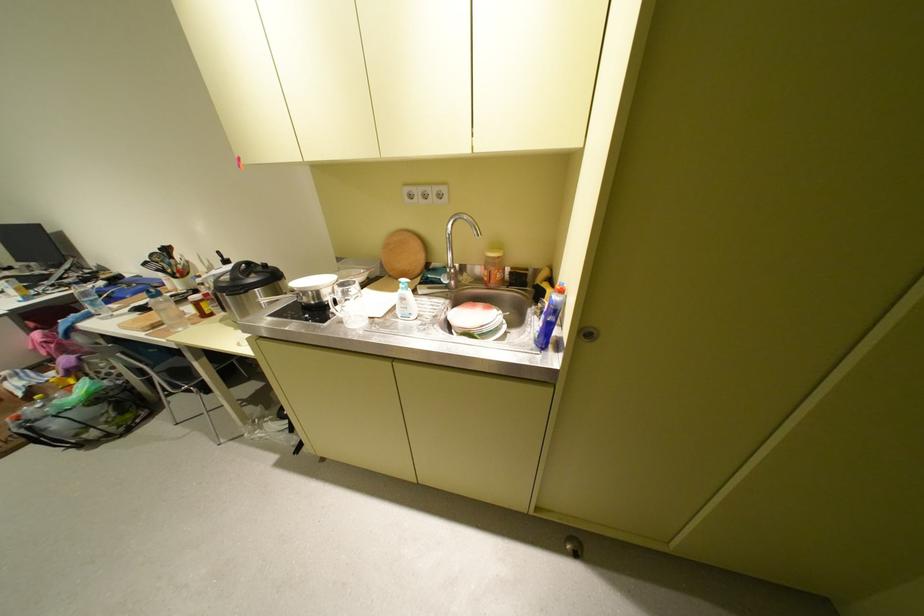
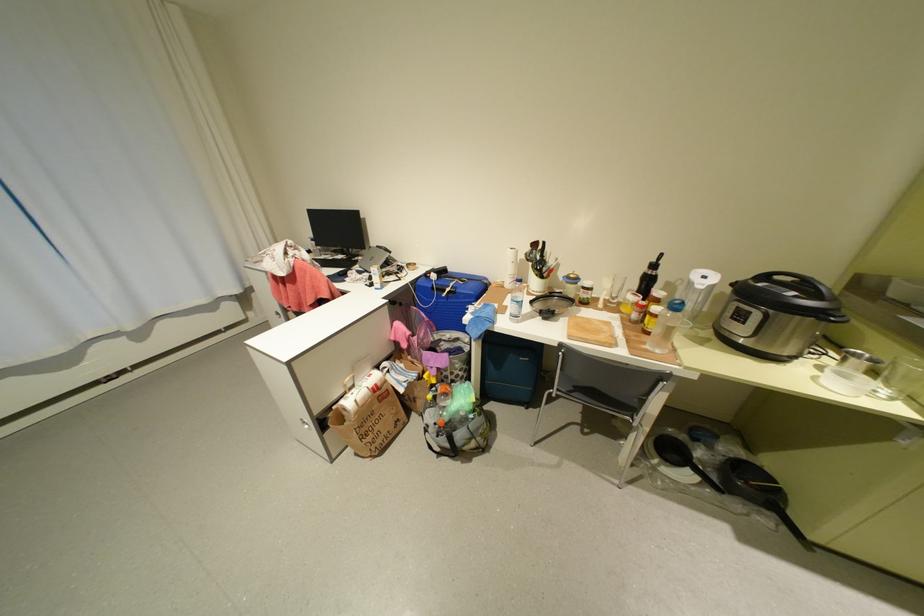
In the second image, find the point that corresponds to (x=297, y=429) in the first image.

(711, 484)